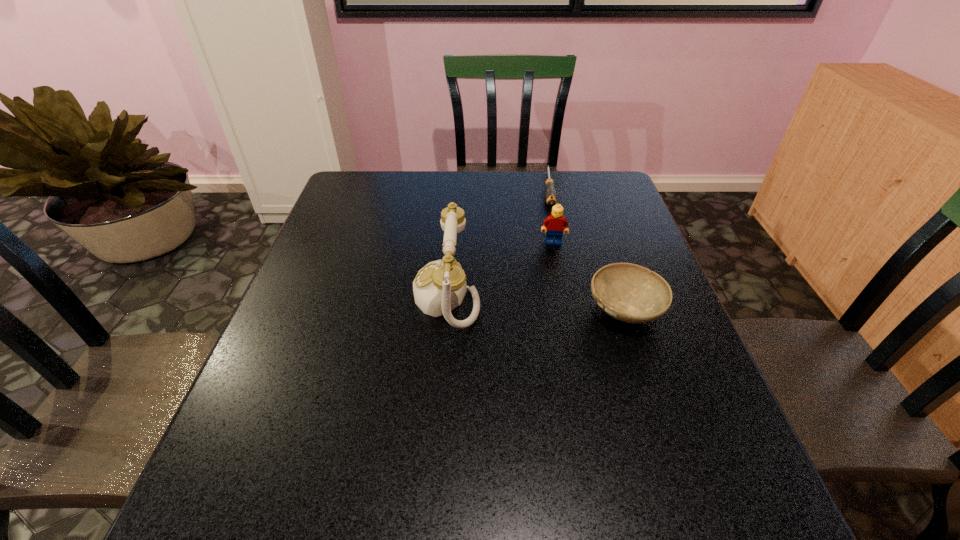
Locate an element on the screen. free spot on the desktop that is between the leftmost object and the bowl and is positioned at the tip of the farthest object is located at coordinates (558, 303).

Where is `free spot on the desktop that is between the tallest object and the second shortest object and is positioned on the front-facing side of the Lego`? This screenshot has width=960, height=540. free spot on the desktop that is between the tallest object and the second shortest object and is positioned on the front-facing side of the Lego is located at coordinates (555, 303).